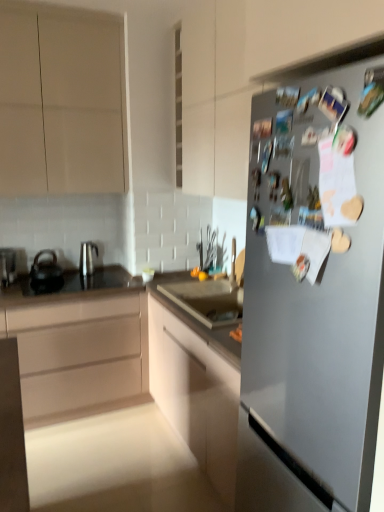
In order to click on empty space that is to the right of black matte tea pot at left, acting as the 2th tea pot starting from the right in this screenshot , I will do `click(77, 282)`.